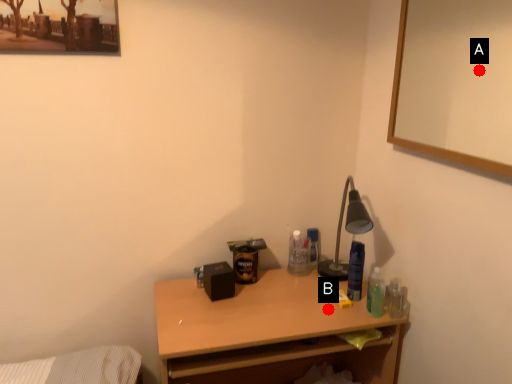
Question: Two points are circled on the image, labeled by A and B beside each circle. Which point appears farthest from the camera in this image?

Choices:
 (A) A is further
 (B) B is further

Answer: (A)